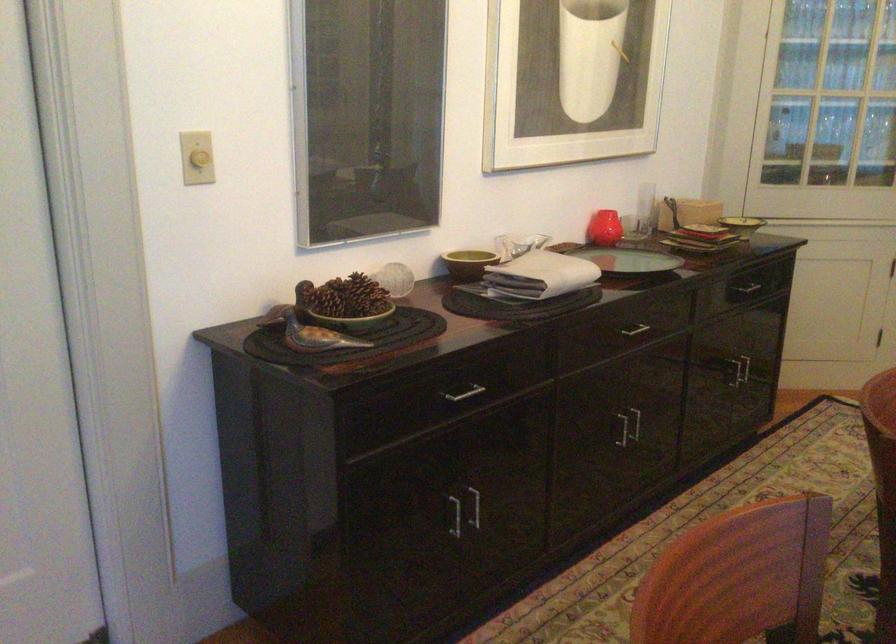
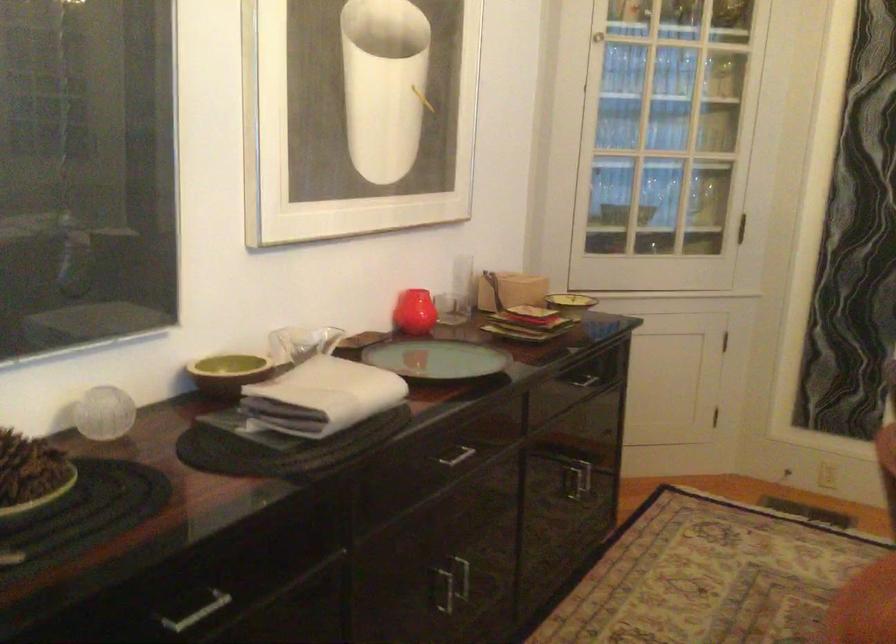
Find the pixel in the second image that matches point (609, 228) in the first image.

(414, 312)